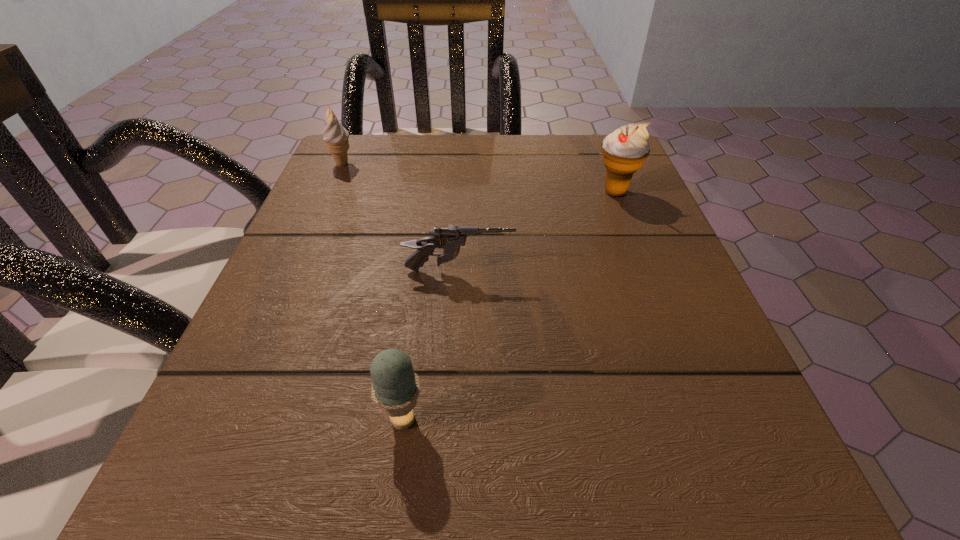
The height and width of the screenshot is (540, 960). I want to click on vacant space that satisfies the following two spatial constraints: 1. on the front-facing side of the farthest object; 2. on the back side of the nearest object, so click(x=229, y=419).

Where is `free spot that satisfies the following two spatial constraints: 1. on the front-facing side of the tallest object; 2. on the right side of the leftmost ice cream`? The width and height of the screenshot is (960, 540). free spot that satisfies the following two spatial constraints: 1. on the front-facing side of the tallest object; 2. on the right side of the leftmost ice cream is located at coordinates (329, 192).